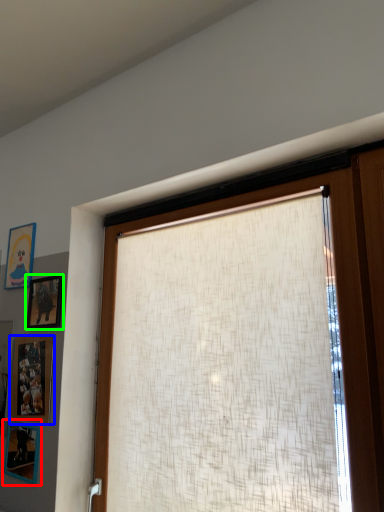
Question: Which is farther away from picture frame (highlighted by a red box)? picture frame (highlighted by a blue box) or picture frame (highlighted by a green box)?

Choices:
 (A) picture frame
 (B) picture frame

Answer: (B)